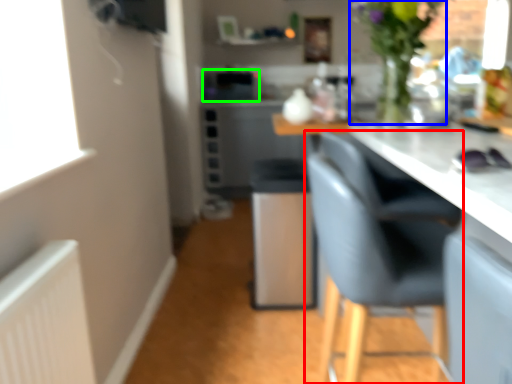
Question: Which object is positioned farthest from chair (highlighted by a red box)? Select from floral arrangement (highlighted by a blue box) and appliance (highlighted by a green box).

Choices:
 (A) floral arrangement
 (B) appliance

Answer: (B)